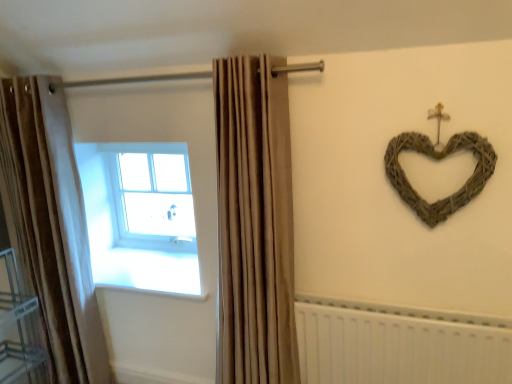
Question: Is white glass window at upper left inside or outside of white plastic radiator at lower right?

Choices:
 (A) outside
 (B) inside

Answer: (A)

Question: In terms of height, does white glass window at upper left look taller or shorter compared to white plastic radiator at lower right?

Choices:
 (A) tall
 (B) short

Answer: (A)

Question: Considering the real-world distances, which object is closest to the beige velvet curtain at left, the 2th curtain in the right-to-left sequence?

Choices:
 (A) white glass window at upper left
 (B) beige fabric curtain at center, which appears as the 2th curtain when viewed from the left
 (C) metallic silver shelf at lower left
 (D) white plastic radiator at lower right
 (E) woven natural heart at upper right

Answer: (C)

Question: Which object is positioned closest to the woven natural heart at upper right?

Choices:
 (A) white glass window at upper left
 (B) white plastic radiator at lower right
 (C) beige velvet curtain at left, which is counted as the 1th curtain, starting from the left
 (D) metallic silver shelf at lower left
 (E) beige fabric curtain at center, which ranks as the first curtain in right-to-left order

Answer: (B)